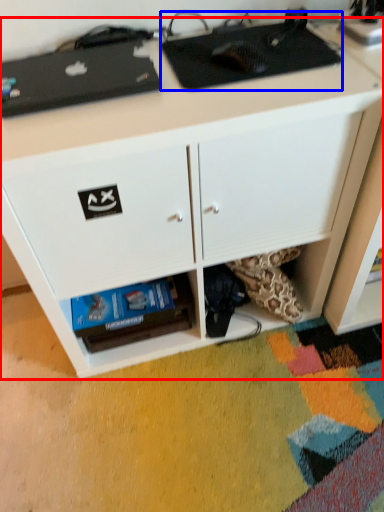
Question: Among these objects, which one is farthest to the camera, desk (highlighted by a red box) or appliance (highlighted by a blue box)?

Choices:
 (A) desk
 (B) appliance

Answer: (B)